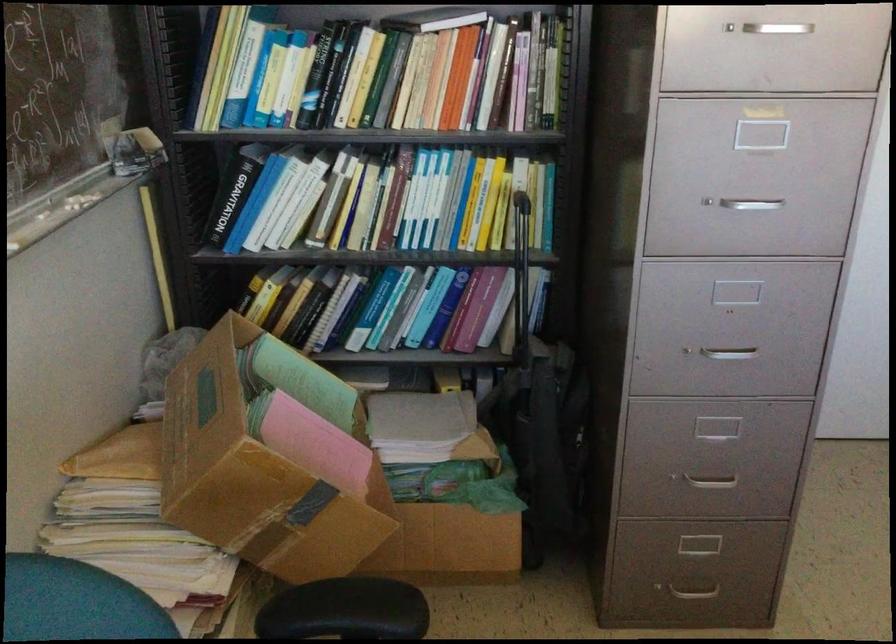
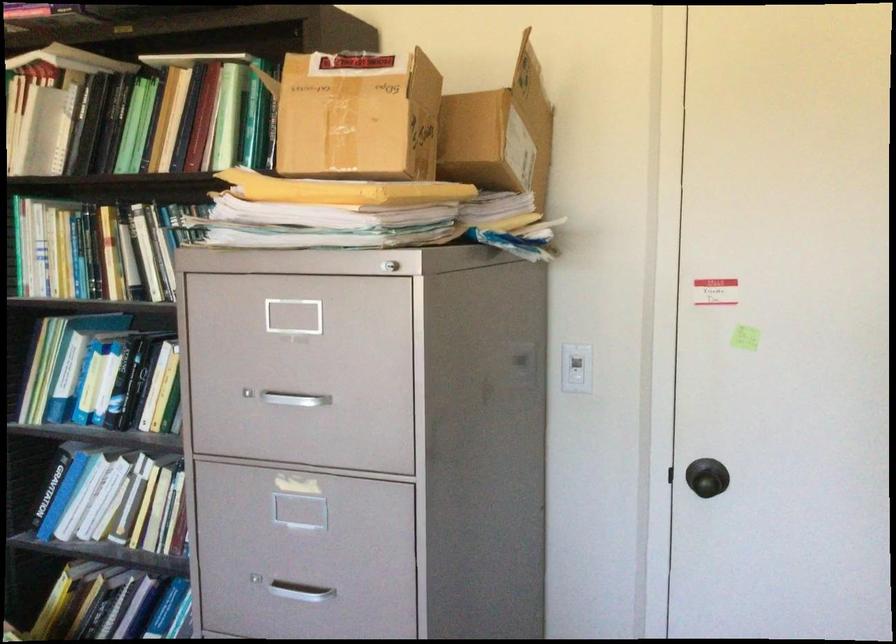
Question: Which direction would the cameraman need to move to produce the second image? Reply with the corresponding letter.

Choices:
 (A) Left
 (B) Right
 (C) Forward
 (D) Backward

Answer: (B)